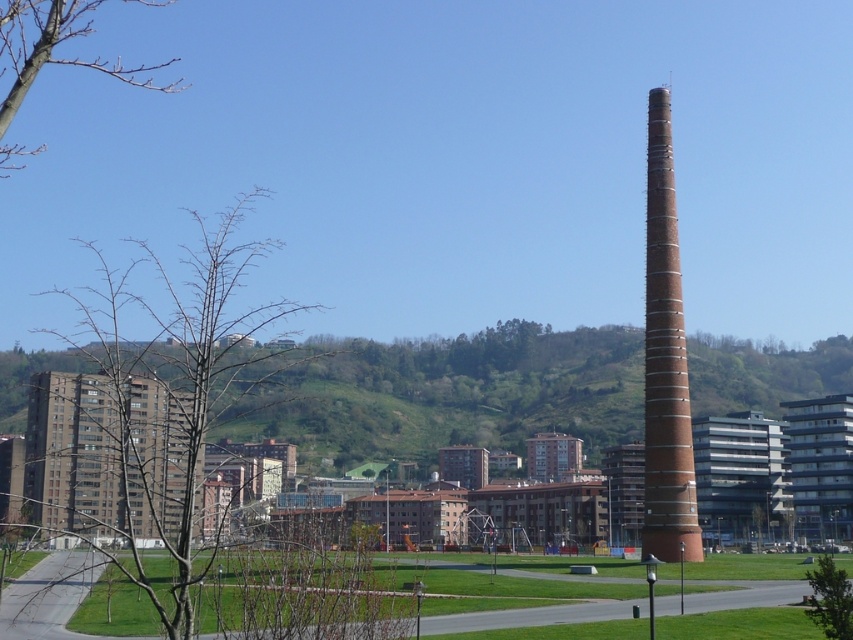
You are a bird looking for a nesting spot. You see the bare branches at left and the green leafy tree at lower right. Which tree would you choose if you want to build a nest higher up?

The bare branches at left has a greater height compared to the green leafy tree at lower right, so the bird should choose the bare branches at left to build a nest higher up.

You are standing in the park and want to take a photo of both the point at coordinates point (82,401) and the point at coordinates point (842,636). Which point should you focus on first to ensure both are in focus?

You should focus on the point at coordinates point (82,401) first because it is closer to you than the point at coordinates point (842,636). This way, both points will be in focus when taking the photo.